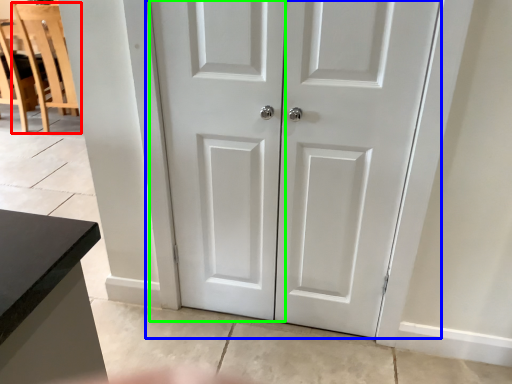
Question: Considering the real-world distances, which object is farthest from chair (highlighted by a red box)? door (highlighted by a blue box) or screen door (highlighted by a green box)?

Choices:
 (A) door
 (B) screen door

Answer: (A)